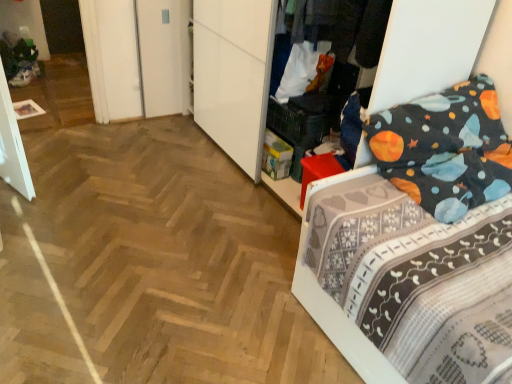
Image resolution: width=512 pixels, height=384 pixels. What do you see at coordinates (418, 245) in the screenshot?
I see `dark blue fabric bed at right` at bounding box center [418, 245].

I want to click on dark blue fabric bed at right, so click(418, 245).

Describe the element at coordinates (344, 26) in the screenshot. I see `dark gray fabric at upper center` at that location.

At what (x,y) coordinates should I click in order to perform the action: click on dark gray fabric at upper center. Please return your answer as a coordinate pair (x, y). Image resolution: width=512 pixels, height=384 pixels. Looking at the image, I should click on (344, 26).

What is the approximate width of dark gray fabric at upper center?

dark gray fabric at upper center is 17.72 inches in width.

In order to click on dark blue fabric bed at right in this screenshot , I will do `click(418, 245)`.

Considering the relative positions of dark blue fabric bed at right and dark gray fabric at upper center in the image provided, is dark blue fabric bed at right to the right of dark gray fabric at upper center from the viewer's perspective?

Correct, you'll find dark blue fabric bed at right to the right of dark gray fabric at upper center.

Which object is further away from the camera taking this photo, dark blue fabric bed at right or dark gray fabric at upper center?

dark gray fabric at upper center is further from the camera.

Is point (383, 162) more distant than point (334, 35)?

No.

From the image's perspective, would you say dark blue fabric bed at right is positioned over dark gray fabric at upper center?

Incorrect, from the image's perspective, dark blue fabric bed at right is lower than dark gray fabric at upper center.

From a real-world perspective, which object rests below the other?

dark blue fabric bed at right, from a real-world perspective.

Between dark blue fabric bed at right and dark gray fabric at upper center, which one has smaller width?

dark gray fabric at upper center is thinner.

Can you confirm if dark blue fabric bed at right is taller than dark gray fabric at upper center?

Yes.

Who is smaller, dark blue fabric bed at right or dark gray fabric at upper center?

dark gray fabric at upper center is smaller.

Choose the correct answer: Is dark blue fabric bed at right inside dark gray fabric at upper center or outside it?

dark blue fabric bed at right is not enclosed by dark gray fabric at upper center.

Would you consider dark blue fabric bed at right to be distant from dark gray fabric at upper center?

That's not correct — dark blue fabric bed at right is a little close to dark gray fabric at upper center.

Could you tell me if dark blue fabric bed at right is facing dark gray fabric at upper center?

No.

What's the angular difference between dark blue fabric bed at right and dark gray fabric at upper center's facing directions?

The facing directions of dark blue fabric bed at right and dark gray fabric at upper center are 89.2 degrees apart.

How far apart are dark blue fabric bed at right and dark gray fabric at upper center?

They are 26.42 inches apart.

The image size is (512, 384). Identify the location of clothing on the left of dark blue fabric bed at right. (344, 26).

Considering the relative positions of dark gray fabric at upper center and dark blue fabric bed at right in the image provided, is dark gray fabric at upper center to the right of dark blue fabric bed at right from the viewer's perspective?

No.

Who is more distant, dark gray fabric at upper center or dark blue fabric bed at right?

dark gray fabric at upper center is more distant.

Does point (356, 37) come in front of point (460, 341)?

No, it is behind (460, 341).

From the image's perspective, between dark gray fabric at upper center and dark blue fabric bed at right, who is located below?

dark blue fabric bed at right is shown below in the image.

From a real-world perspective, is dark gray fabric at upper center below dark blue fabric bed at right?

No, from a real-world perspective, dark gray fabric at upper center is not below dark blue fabric bed at right.

Considering the sizes of dark gray fabric at upper center and dark blue fabric bed at right in the image, is dark gray fabric at upper center wider or thinner than dark blue fabric bed at right?

Considering their sizes, dark gray fabric at upper center looks slimmer than dark blue fabric bed at right.

Who is shorter, dark gray fabric at upper center or dark blue fabric bed at right?

dark gray fabric at upper center.

Between dark gray fabric at upper center and dark blue fabric bed at right, which one has larger size?

With larger size is dark blue fabric bed at right.

Is dark blue fabric bed at right surrounded by dark gray fabric at upper center?

No, dark blue fabric bed at right is not a part of dark gray fabric at upper center.

Are dark gray fabric at upper center and dark blue fabric bed at right far apart?

No.

Is dark gray fabric at upper center oriented towards dark blue fabric bed at right?

No, dark gray fabric at upper center is not oriented towards dark blue fabric bed at right.

Can you tell me how much dark gray fabric at upper center and dark blue fabric bed at right differ in facing direction?

There is a 89.2-degree angle between the facing directions of dark gray fabric at upper center and dark blue fabric bed at right.

Measure the distance from dark gray fabric at upper center to dark blue fabric bed at right.

dark gray fabric at upper center and dark blue fabric bed at right are 26.42 inches apart.

Locate an element on the screen. The width and height of the screenshot is (512, 384). clothing on the left of dark blue fabric bed at right is located at coordinates (344, 26).

Where is `bed that is under the dark gray fabric at upper center (from a real-world perspective)`? bed that is under the dark gray fabric at upper center (from a real-world perspective) is located at coordinates (418, 245).

What are the coordinates of `clothing located above the dark blue fabric bed at right (from a real-world perspective)` in the screenshot? It's located at (344, 26).